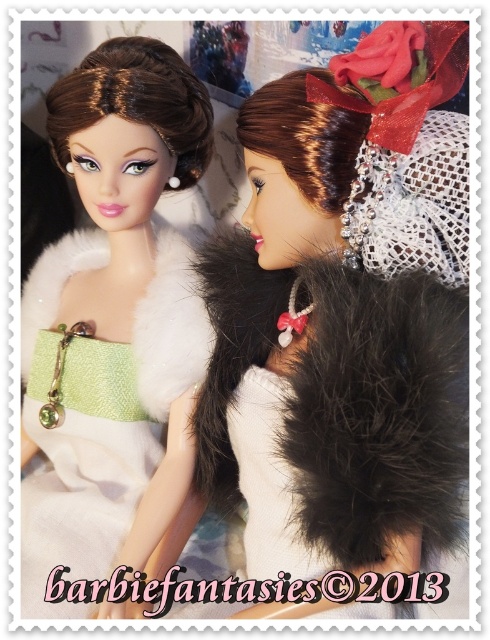
Does matte white fur at upper left have a larger size compared to matte white fur coat at left?

Yes, matte white fur at upper left is bigger than matte white fur coat at left.

Locate an element on the screen. Image resolution: width=490 pixels, height=640 pixels. matte white fur at upper left is located at coordinates (346, 316).